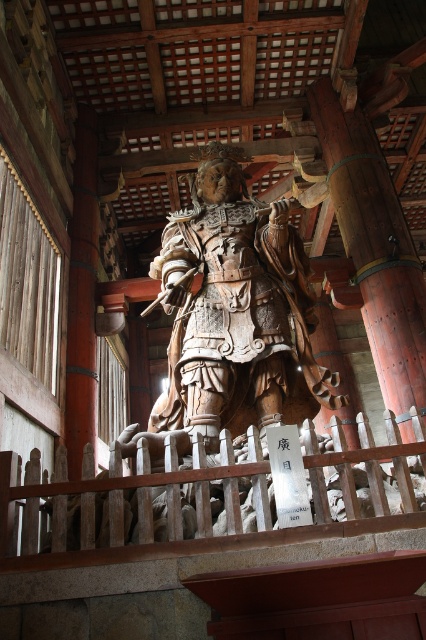
You are standing in the temple and want to take a photo of the wooden statue at center. If you are positioned at point 0.5, 0.5, which is the center of the temple floor, will you be able to see the statue clearly without any obstruction?

The wooden statue at center is located at point (233, 314), which is very close to your position at (213, 320). Since there are no mentioned obstructions in the scene, you should have a clear view of the statue.